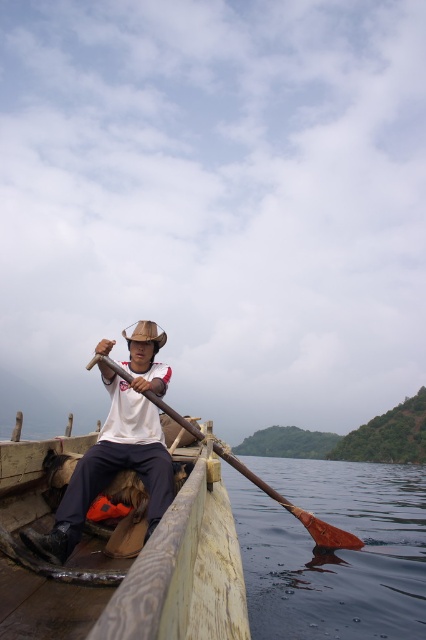
Can you confirm if brown wooden paddle at lower center is positioned below white matte shirt at center?

Yes.

Who is positioned more to the left, brown wooden paddle at lower center or white matte shirt at center?

From the viewer's perspective, white matte shirt at center appears more on the left side.

What do you see at coordinates (333, 552) in the screenshot? Image resolution: width=426 pixels, height=640 pixels. I see `brown wooden paddle at lower center` at bounding box center [333, 552].

You are a GUI agent. You are given a task and a screenshot of the screen. Output one action in this format:
    pyautogui.click(x=<x>, y=<y>)
    Task: Click on the brown wooden paddle at lower center
    The image size is (426, 640).
    Given the screenshot: What is the action you would take?
    pyautogui.click(x=333, y=552)

Is wooden canoe at center taller than white matte shirt at center?

Incorrect, wooden canoe at center's height is not larger of white matte shirt at center's.

Can you confirm if wooden canoe at center is shorter than white matte shirt at center?

Yes.

Describe the element at coordinates (121, 564) in the screenshot. I see `wooden canoe at center` at that location.

You are a GUI agent. You are given a task and a screenshot of the screen. Output one action in this format:
    pyautogui.click(x=<x>, y=<y>)
    Task: Click on the wooden canoe at center
    
    Given the screenshot: What is the action you would take?
    pyautogui.click(x=121, y=564)

Is brown wooden paddle at lower center taller than brown wooden paddle at center?

Yes.

The width and height of the screenshot is (426, 640). In order to click on brown wooden paddle at lower center in this screenshot , I will do `click(333, 552)`.

The height and width of the screenshot is (640, 426). I want to click on brown wooden paddle at lower center, so click(333, 552).